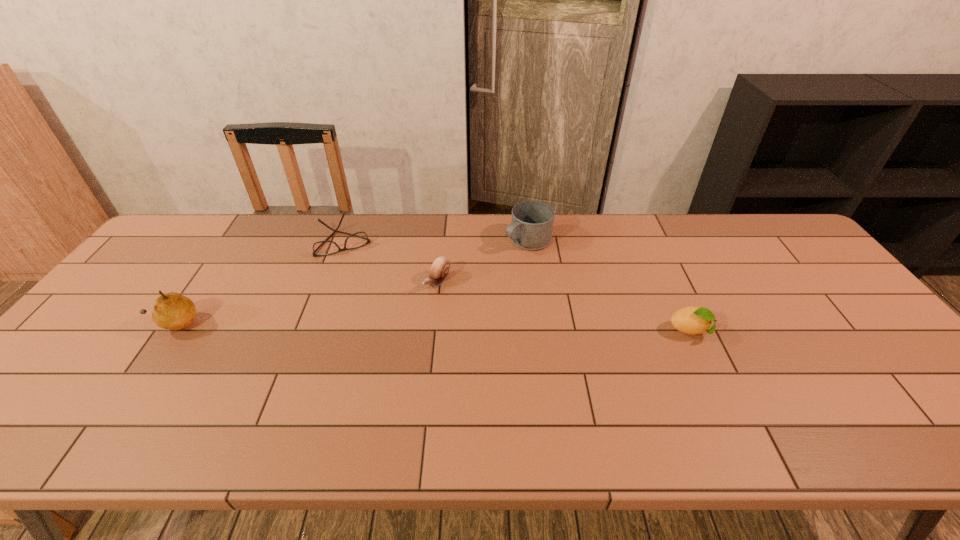
In order to click on vacant point that satisfies the following two spatial constraints: 1. on the front side of the fourth object from left to right; 2. on the left side of the spectacles in this screenshot , I will do `click(345, 241)`.

I want to click on blank space that satisfies the following two spatial constraints: 1. on the front side of the lemon; 2. with leaves positioned above the leftmost object, so click(x=169, y=332).

Identify the location of vacant space that satisfies the following two spatial constraints: 1. on the back side of the third farthest object; 2. on the right side of the pear. The image size is (960, 540). (204, 282).

What are the coordinates of `free space that satisfies the following two spatial constraints: 1. on the front side of the lemon; 2. with leaves positioned above the mug` in the screenshot? It's located at (x=540, y=332).